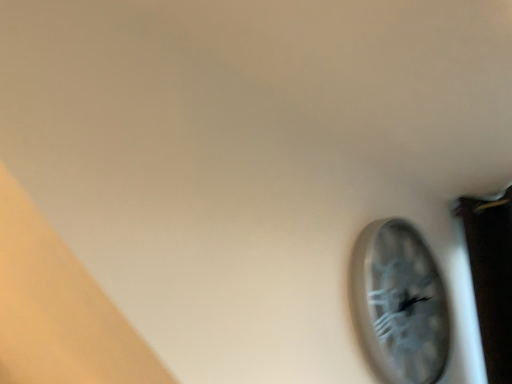
Describe the element at coordinates (400, 303) in the screenshot. I see `metallic silver clock at right` at that location.

You are a GUI agent. You are given a task and a screenshot of the screen. Output one action in this format:
    pyautogui.click(x=<x>, y=<y>)
    Task: Click on the metallic silver clock at right
    
    Given the screenshot: What is the action you would take?
    pyautogui.click(x=400, y=303)

What is the approximate width of metallic silver clock at right?

metallic silver clock at right is 2.86 inches wide.

I want to click on metallic silver clock at right, so click(x=400, y=303).